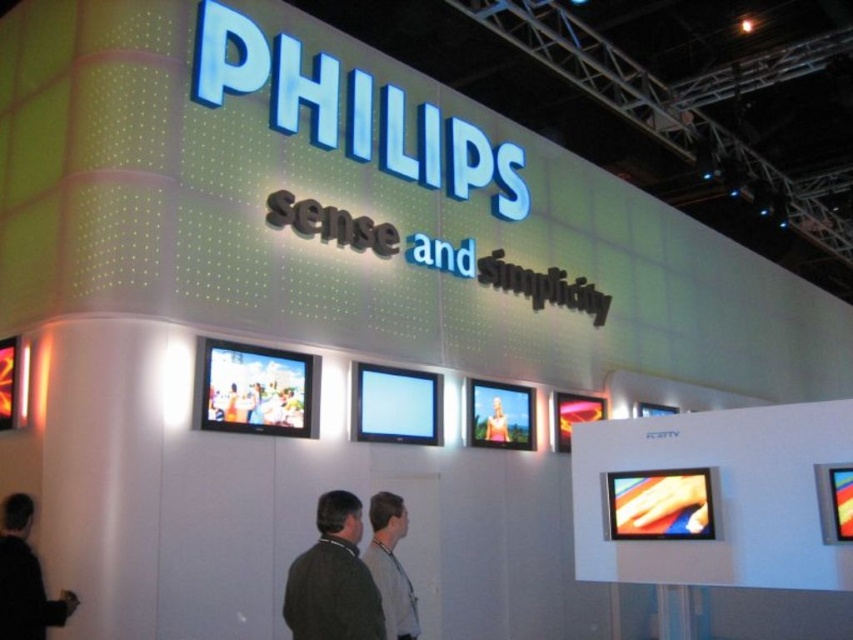
Question: Which of the following is the closest to the observer?

Choices:
 (A) (509, 436)
 (B) (395, 620)

Answer: (B)

Question: Can you confirm if dark gray sweater at lower center is positioned to the left of dark gray jacket at lower left?

Choices:
 (A) yes
 (B) no

Answer: (B)

Question: Which object is the farthest from the dark gray jacket at lower left?

Choices:
 (A) dark gray sweater at lower center
 (B) smooth skin person at center

Answer: (B)

Question: Which point is farther to the camera?

Choices:
 (A) (3, 541)
 (B) (502, 419)
 (C) (343, 524)

Answer: (B)

Question: In this image, where is dark gray sweater at lower center located relative to dark gray jacket at lower left?

Choices:
 (A) right
 (B) left

Answer: (A)

Question: Does dark gray jacket at lower left have a smaller size compared to smooth skin person at center?

Choices:
 (A) no
 (B) yes

Answer: (A)